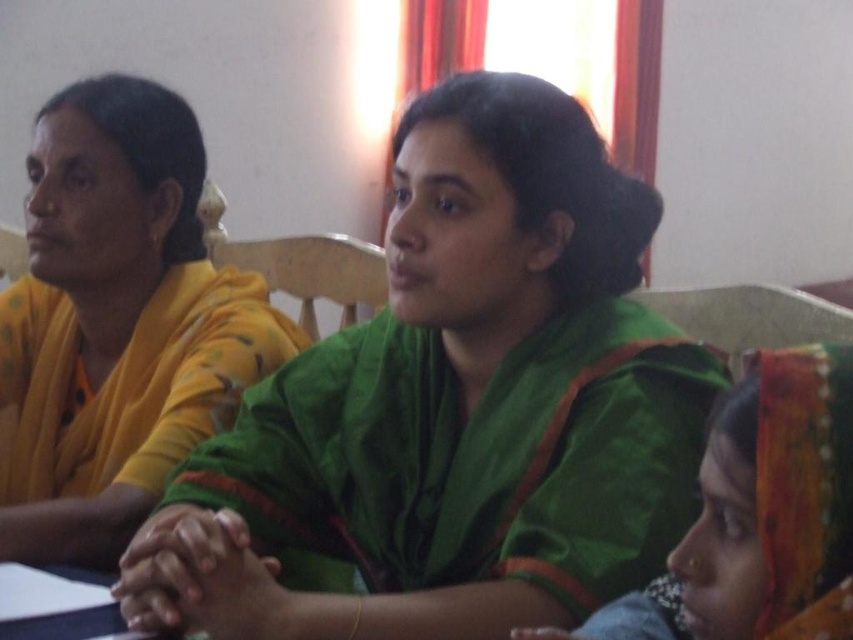
Question: Can you confirm if yellow fabric saree at left is bigger than green velvet sari at center?

Choices:
 (A) no
 (B) yes

Answer: (B)

Question: Which of the following is the farthest from the observer?

Choices:
 (A) (90, 99)
 (B) (602, 292)
 (C) (815, 570)

Answer: (A)

Question: Is the position of yellow fabric saree at left more distant than that of green velvet sari at center?

Choices:
 (A) yes
 (B) no

Answer: (A)

Question: Is green silk saree at center above green velvet sari at center?

Choices:
 (A) yes
 (B) no

Answer: (A)

Question: Which point appears farthest from the camera in this image?

Choices:
 (A) (762, 369)
 (B) (474, 100)

Answer: (B)

Question: Which point appears farthest from the camera in this image?

Choices:
 (A) (685, 616)
 (B) (143, 378)
 (C) (424, 461)

Answer: (B)